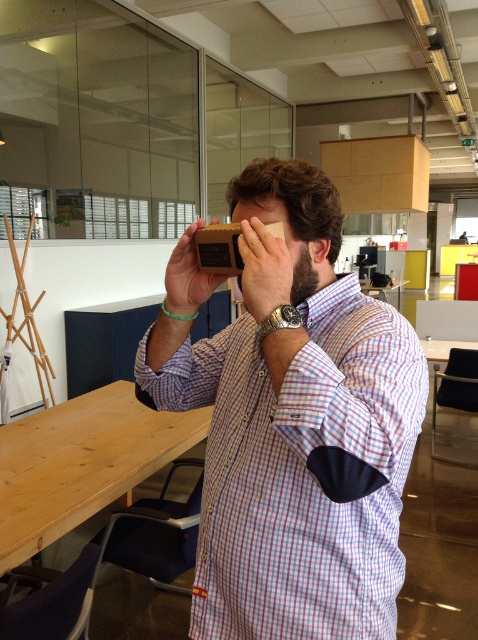
You are organizing a meeting in this office space and need to place a new chair. The wooden block at center is currently in the way. To move it out of the way, should you move it forward or backward relative to the wooden table at lower left?

The wooden block at center is behind the wooden table at lower left, so to move it out of the way, you should move it forward away from the wooden table at lower left.

You are organizing a small event in this office space and need to place a decorative item on the wooden table at lower left and the wooden block at center. Since both surfaces are available, which one can accommodate a larger centerpiece?

The wooden table at lower left is bigger than the wooden block at center, so it can accommodate a larger centerpiece.

You are standing in the office space and need to place a new item on the matte wooden box at center. What is the exact coordinate where you should place it?

The matte wooden box at center is located at point (296,435), so you should place the new item there.